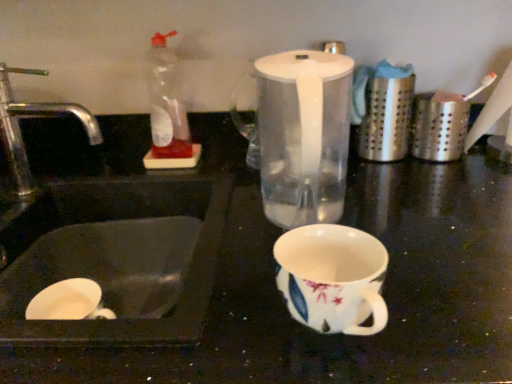
Question: In the image, is transparent plastic blender at center positioned in front of or behind white glossy sink at lower left?

Choices:
 (A) behind
 (B) front

Answer: (A)

Question: Choose the correct answer: Is transparent plastic blender at center inside white glossy sink at lower left or outside it?

Choices:
 (A) outside
 (B) inside

Answer: (A)

Question: Estimate the real-world distances between objects in this image. Which object is farther from the white glossy sink at lower left?

Choices:
 (A) silver metallic faucet at left
 (B) transparent plastic blender at center

Answer: (B)

Question: Which object is positioned farthest from the transparent plastic blender at center?

Choices:
 (A) silver metallic faucet at left
 (B) white glossy sink at lower left

Answer: (A)